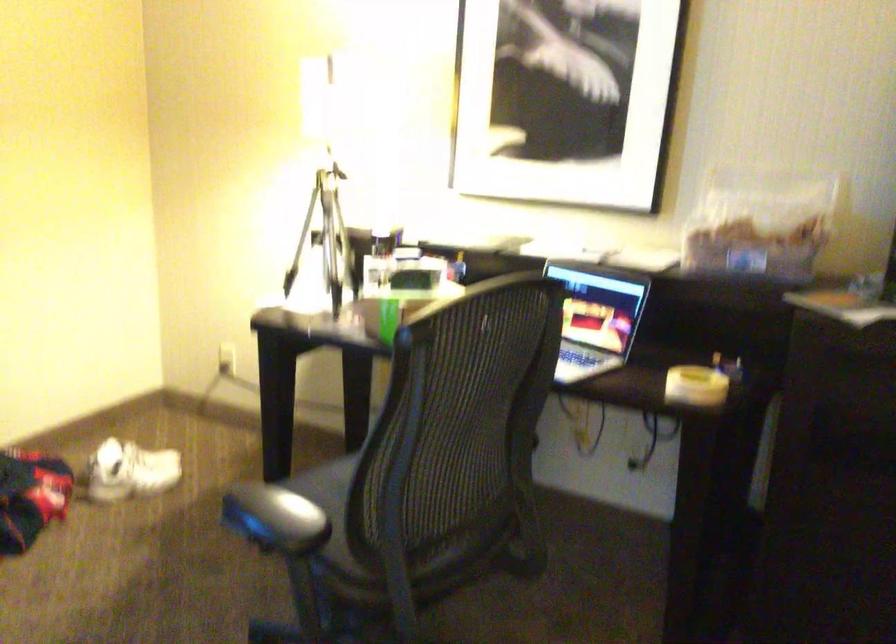
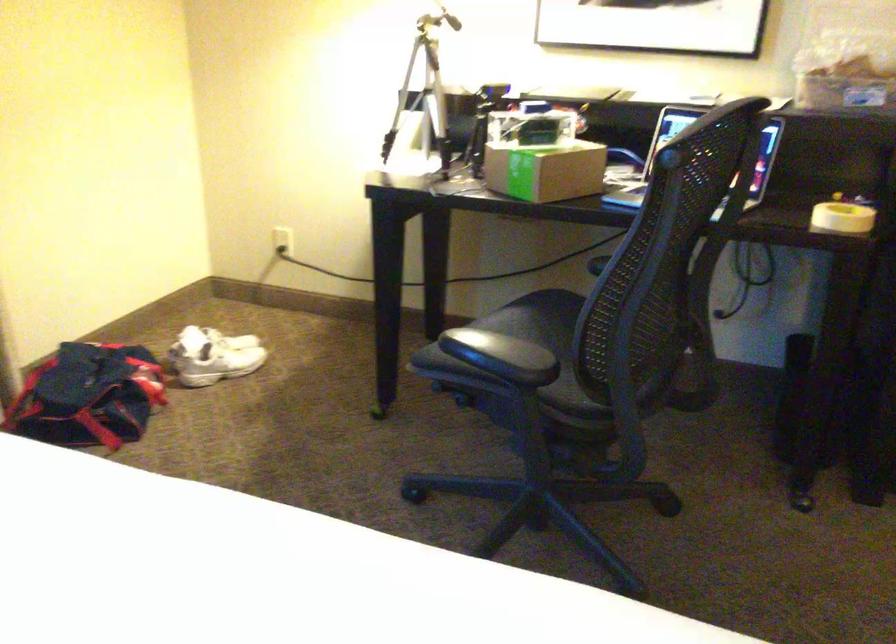
Question: Which direction would the cameraman need to move to produce the second image? Reply with the corresponding letter.

Choices:
 (A) Left
 (B) Right
 (C) Forward
 (D) Backward

Answer: (A)